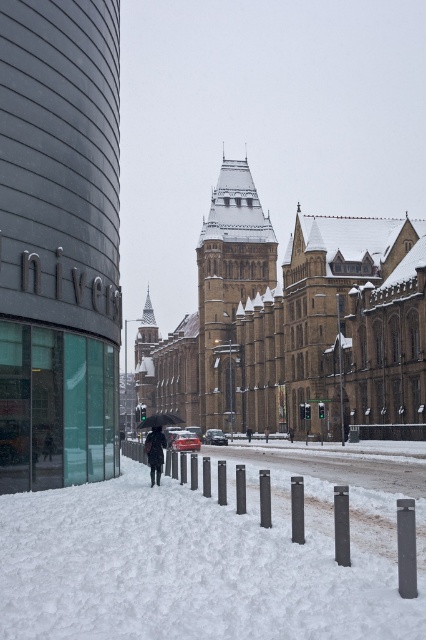
Question: Among these objects, which one is farthest from the camera?

Choices:
 (A) black matte umbrella at center
 (B) white powdery snow at center
 (C) dark wool coat at center

Answer: (A)

Question: From the image, what is the correct spatial relationship of dark wool coat at center in relation to black matte umbrella at center?

Choices:
 (A) below
 (B) above

Answer: (B)

Question: Is dark wool coat at center further to the viewer compared to black matte umbrella at center?

Choices:
 (A) no
 (B) yes

Answer: (A)

Question: Is white powdery snow at center bigger than black matte umbrella at center?

Choices:
 (A) yes
 (B) no

Answer: (B)

Question: Which point is farther from the camera taking this photo?

Choices:
 (A) 164,577
 (B) 169,419

Answer: (B)

Question: Which object is farther from the camera taking this photo?

Choices:
 (A) dark wool coat at center
 (B) white powdery snow at center
 (C) black matte umbrella at center

Answer: (C)